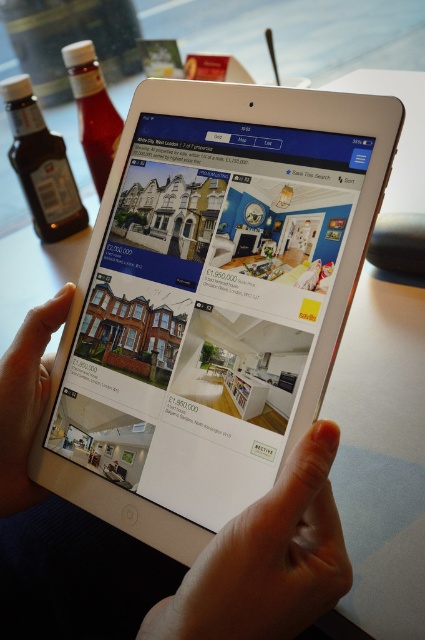
Question: Which object appears farthest from the camera in this image?

Choices:
 (A) skinny white finger at upper center
 (B) white glossy tablet computer at center
 (C) skinny white hand at lower center

Answer: (C)

Question: From the image, what is the correct spatial relationship of smooth white tablet at center in relation to skinny white hand at lower center?

Choices:
 (A) right
 (B) left

Answer: (A)

Question: Does white glossy tablet computer at center have a larger size compared to smooth white tablet at center?

Choices:
 (A) no
 (B) yes

Answer: (A)

Question: Which object is positioned closest to the skinny white hand at lower center?

Choices:
 (A) skinny white finger at upper center
 (B) smooth white tablet at center
 (C) white glossy tablet computer at center

Answer: (B)

Question: Based on their relative distances, which object is nearer to the smooth white tablet at center?

Choices:
 (A) white glossy tablet computer at center
 (B) skinny white hand at lower center
 (C) skinny white finger at upper center

Answer: (B)

Question: Can you confirm if smooth white tablet at center is positioned to the right of skinny white hand at lower center?

Choices:
 (A) yes
 (B) no

Answer: (A)